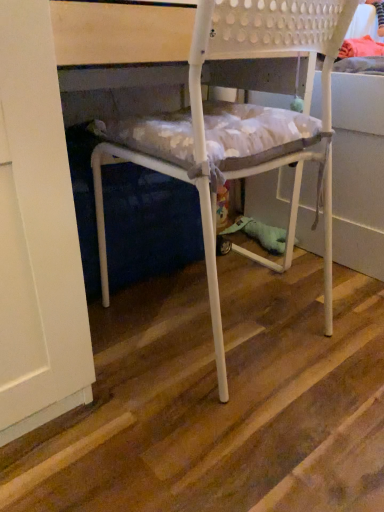
Image resolution: width=384 pixels, height=512 pixels. In order to click on vacant space to the right of white matte plastic chair at center in this screenshot , I will do `click(335, 314)`.